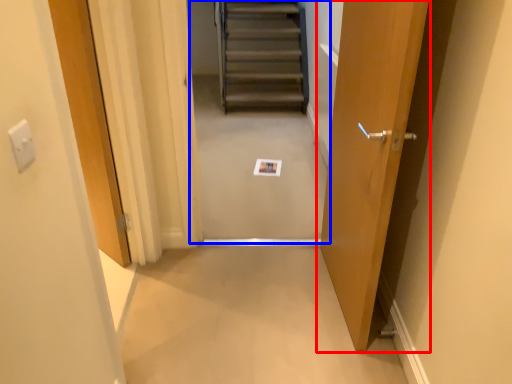
Question: Which point is further to the camera, door (highlighted by a red box) or escalator (highlighted by a blue box)?

Choices:
 (A) door
 (B) escalator

Answer: (B)